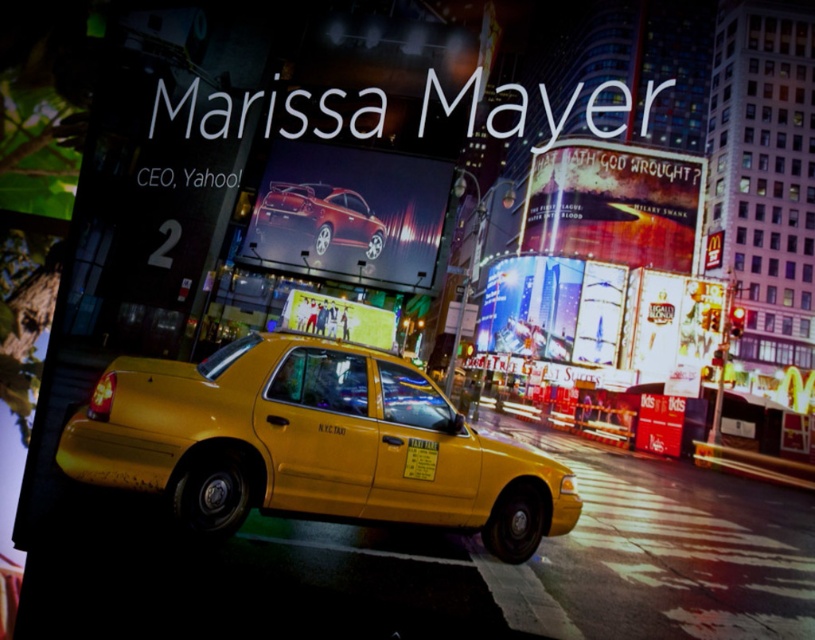
Can you confirm if shiny yellow taxi at center is bigger than shiny metallic car at center?

Yes.

Is shiny yellow taxi at center above shiny metallic car at center?

Actually, shiny yellow taxi at center is below shiny metallic car at center.

Does point (227, 486) come farther from viewer compared to point (368, 188)?

That is False.

Identify the location of shiny yellow taxi at center. (x=311, y=444).

Does shiny metallic car at center appear under shiny red car at center?

Correct, shiny metallic car at center is located below shiny red car at center.

Describe the element at coordinates (349, 212) in the screenshot. I see `shiny metallic car at center` at that location.

Locate an element on the screen. The height and width of the screenshot is (640, 815). shiny metallic car at center is located at coordinates (349, 212).

Who is lower down, matte white billboard at upper right or white glossy billboard at center?

white glossy billboard at center is below.

Does matte white billboard at upper right have a greater width compared to white glossy billboard at center?

Indeed, matte white billboard at upper right has a greater width compared to white glossy billboard at center.

Between point (573, 202) and point (375, 337), which one is positioned behind?

The point (573, 202) is more distant.

Identify the location of matte white billboard at upper right. (615, 204).